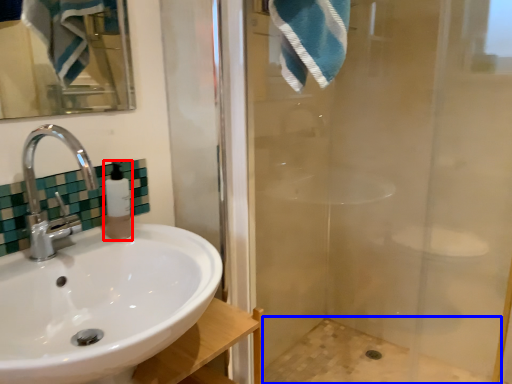
Question: Which of the following is the farthest to the observer, soap dispenser (highlighted by a red box) or bath (highlighted by a blue box)?

Choices:
 (A) soap dispenser
 (B) bath

Answer: (B)